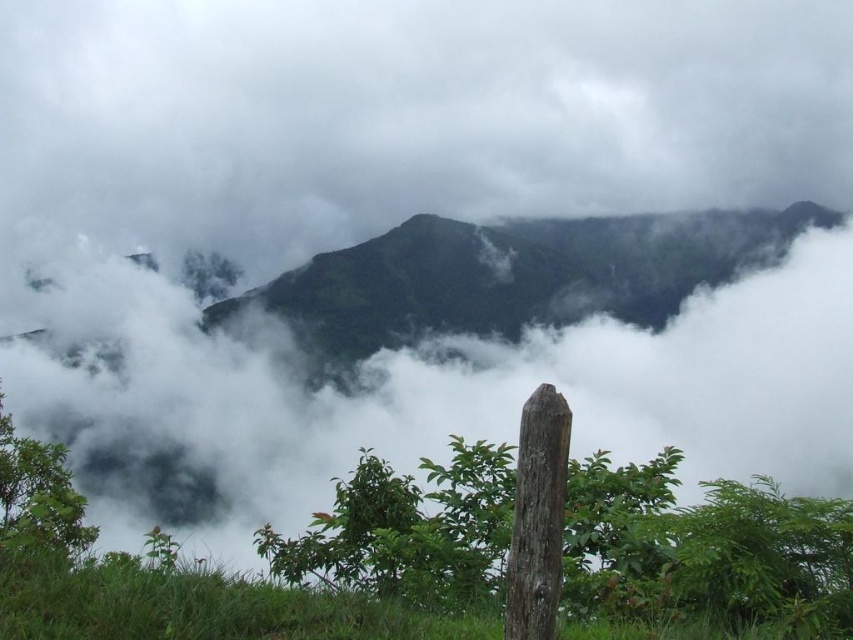
From the picture: You are an artist planning to paint this landscape. You want to ensure the green matte mountain at center and the brown rough wood pole at center are proportionally accurate. Which object should you make wider in your painting?

The green matte mountain at center should be made wider in the painting since its width is larger than the brown rough wood pole at center according to the description.